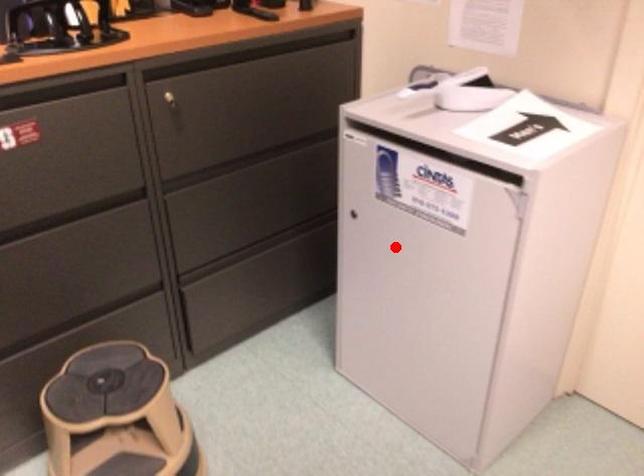
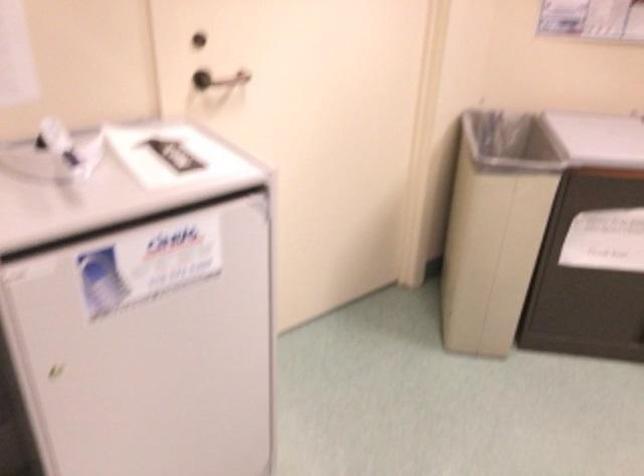
Question: I am providing you with two images of the same scene from different viewpoints. A red point is shown in image1. For the corresponding object point in image2, is it positioned nearer or farther from the camera?

Choices:
 (A) Nearer
 (B) Farther

Answer: (A)